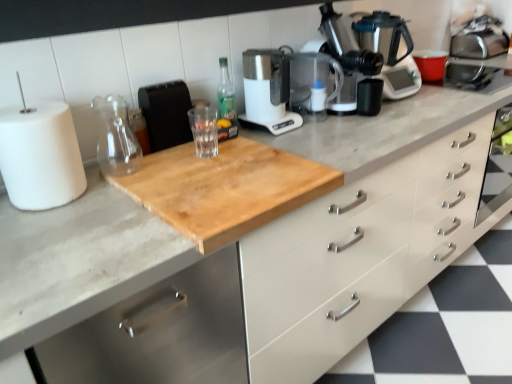
Question: From a real-world perspective, is white matte drawer at center on top of transparent glass jar at upper center, the 1th glass jar positioned from the left?

Choices:
 (A) no
 (B) yes

Answer: (A)

Question: Does white matte drawer at center turn towards transparent glass jar at upper center, the 1th glass jar positioned from the left?

Choices:
 (A) yes
 (B) no

Answer: (B)

Question: Considering the relative sizes of white matte drawer at center and transparent glass jar at upper center, which is counted as the second glass jar, starting from the right, in the image provided, is white matte drawer at center smaller than transparent glass jar at upper center, which is counted as the second glass jar, starting from the right,?

Choices:
 (A) no
 (B) yes

Answer: (A)

Question: Can you confirm if white matte drawer at center is shorter than transparent glass jar at upper center, the 1th glass jar positioned from the left?

Choices:
 (A) no
 (B) yes

Answer: (B)

Question: Is white matte drawer at center positioned behind transparent glass jar at upper center, the 1th glass jar positioned from the left?

Choices:
 (A) no
 (B) yes

Answer: (A)

Question: Is white matte drawer at center spatially inside natural wood cutting board at center, or outside of it?

Choices:
 (A) outside
 (B) inside

Answer: (A)

Question: Is white matte drawer at center wider or thinner than natural wood cutting board at center?

Choices:
 (A) wide
 (B) thin

Answer: (A)

Question: Is point (429, 198) positioned closer to the camera than point (234, 354)?

Choices:
 (A) farther
 (B) closer

Answer: (A)

Question: In the image, is white matte drawer at center positioned in front of or behind natural wood cutting board at center?

Choices:
 (A) front
 (B) behind

Answer: (B)

Question: In terms of size, does white matte paper towel at left appear bigger or smaller than satin silver coffee pot at upper right?

Choices:
 (A) small
 (B) big

Answer: (A)

Question: In the image, is white matte paper towel at left positioned in front of or behind satin silver coffee pot at upper right?

Choices:
 (A) behind
 (B) front

Answer: (B)

Question: Considering the positions of white matte paper towel at left and satin silver coffee pot at upper right in the image, is white matte paper towel at left taller or shorter than satin silver coffee pot at upper right?

Choices:
 (A) tall
 (B) short

Answer: (B)

Question: From a real-world perspective, relative to satin silver coffee pot at upper right, is white matte paper towel at left vertically above or below?

Choices:
 (A) above
 (B) below

Answer: (B)

Question: Considering the positions of metallic silver coffee machine at upper right and satin silver coffee pot at upper right in the image, is metallic silver coffee machine at upper right taller or shorter than satin silver coffee pot at upper right?

Choices:
 (A) tall
 (B) short

Answer: (A)

Question: Is metallic silver coffee machine at upper right in front of or behind satin silver coffee pot at upper right in the image?

Choices:
 (A) behind
 (B) front

Answer: (B)